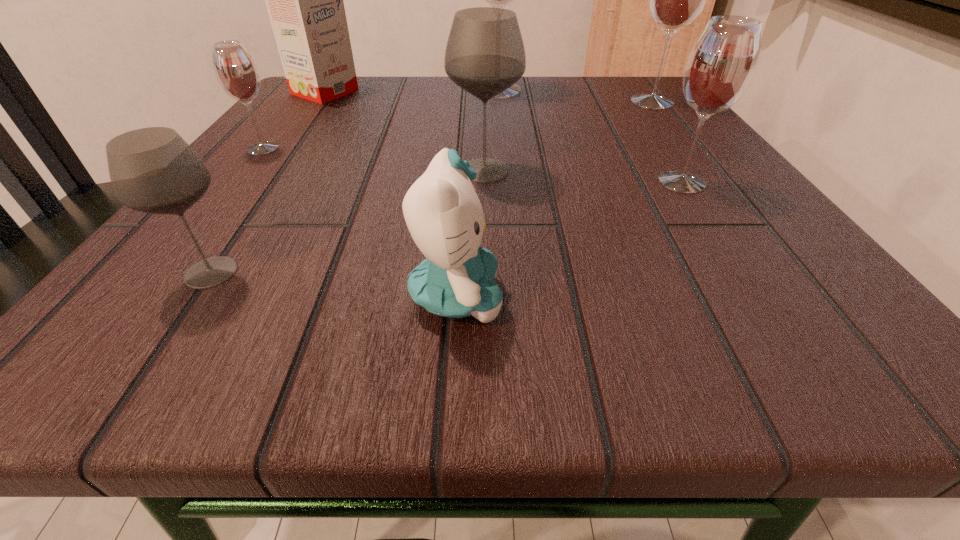
Identify the location of carton present at the far edge. The height and width of the screenshot is (540, 960). (304, 0).

You are a GUI agent. You are given a task and a screenshot of the screen. Output one action in this format:
    pyautogui.click(x=<x>, y=<y>)
    Task: Click on the object positioned at the near edge
    
    Given the screenshot: What is the action you would take?
    pyautogui.click(x=445, y=218)

The image size is (960, 540). Find the location of `carton present at the left edge`. carton present at the left edge is located at coordinates click(304, 0).

The width and height of the screenshot is (960, 540). In order to click on object that is at the far left corner in this screenshot , I will do `click(304, 0)`.

Where is `object that is at the far right corner`? The image size is (960, 540). object that is at the far right corner is located at coordinates (675, 0).

Find the location of `vacant region at the far edge of the desktop`. vacant region at the far edge of the desktop is located at coordinates click(413, 77).

Where is `free region at the near edge`? The height and width of the screenshot is (540, 960). free region at the near edge is located at coordinates (456, 349).

Find the location of `vacant space at the left edge of the desktop`. vacant space at the left edge of the desktop is located at coordinates (285, 151).

The image size is (960, 540). Find the location of `vacant region at the right edge`. vacant region at the right edge is located at coordinates 718,180.

Where is `free space at the far left corner of the desktop`? free space at the far left corner of the desktop is located at coordinates (280, 104).